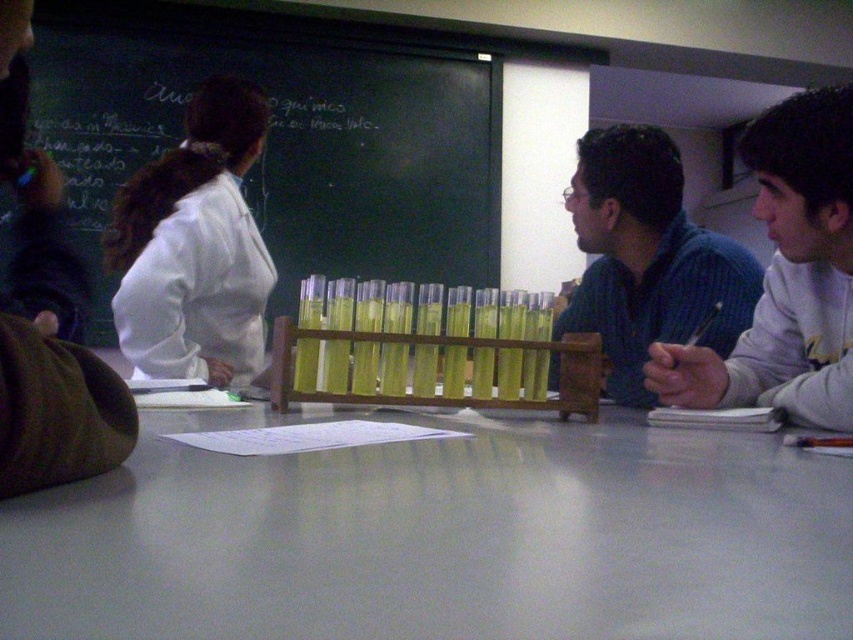
Which is in front, point (202, 124) or point (614, 257)?

Point (614, 257)

Is white lab coat at upper left smaller than blue ribbed sweater at center?

A: Yes.

Describe the element at coordinates (195, 248) in the screenshot. I see `white lab coat at upper left` at that location.

I want to click on white lab coat at upper left, so click(195, 248).

Does white glossy table at center appear on the left side of transparent plastic test tubes at center?

Incorrect, white glossy table at center is not on the left side of transparent plastic test tubes at center.

Can you confirm if white glossy table at center is taller than transparent plastic test tubes at center?

No.

Identify the location of white glossy table at center. (439, 538).

The width and height of the screenshot is (853, 640). In order to click on white glossy table at center in this screenshot , I will do click(439, 538).

Can you confirm if white glossy table at center is positioned above white lab coat at upper left?

No, white glossy table at center is not above white lab coat at upper left.

Does white glossy table at center have a smaller size compared to white lab coat at upper left?

Indeed, white glossy table at center has a smaller size compared to white lab coat at upper left.

Is point (531, 611) positioned after point (254, 262)?

That is False.

Find the location of a particular element. Image resolution: width=853 pixels, height=640 pixels. white glossy table at center is located at coordinates (439, 538).